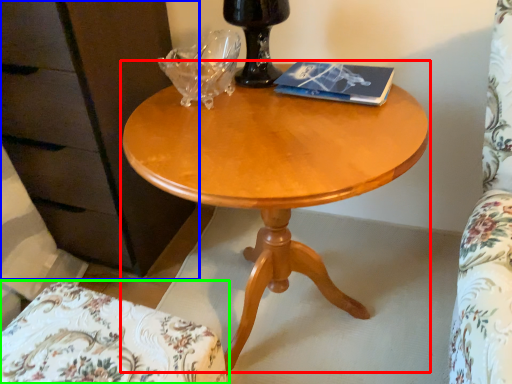
Question: Which object is the closest to the coffee table (highlighted by a red box)? Choose among these: dresser (highlighted by a blue box) or chair (highlighted by a green box).

Choices:
 (A) dresser
 (B) chair

Answer: (B)